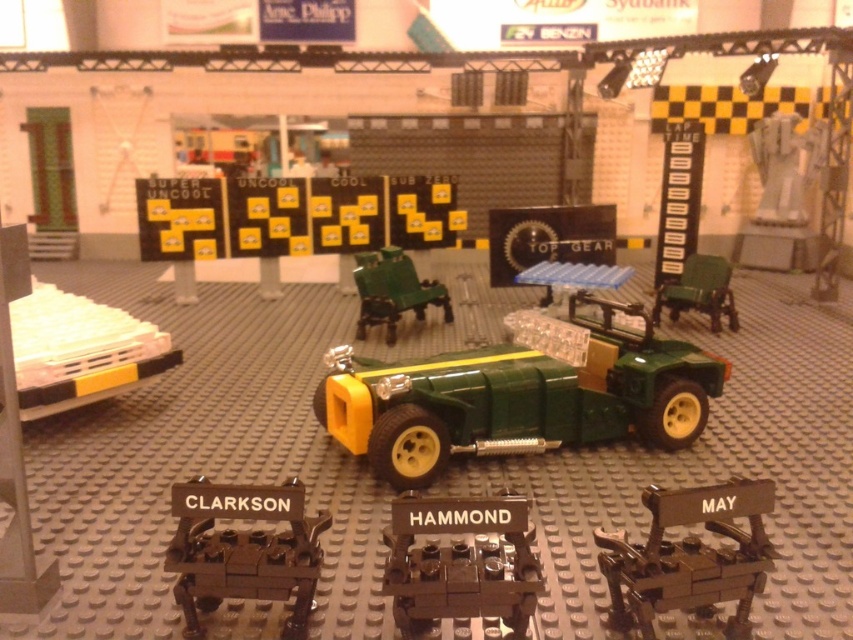
Question: Is green matte toy car at center smaller than white plastic toy at lower left?

Choices:
 (A) yes
 (B) no

Answer: (B)

Question: Among these objects, which one is farthest from the camera?

Choices:
 (A) dark brown metallic engine at lower center
 (B) dark brown wooden chair at center
 (C) metallic black engine at lower center

Answer: (C)

Question: Which object appears closest to the camera in this image?

Choices:
 (A) dark brown metallic engine at lower center
 (B) green matte toy car at center

Answer: (A)

Question: Which of the following is the closest to the observer?

Choices:
 (A) (766, 488)
 (B) (689, 288)
 (C) (300, 580)

Answer: (A)

Question: Does dark brown metallic engine at lower center have a greater width compared to green plastic chairs at center?

Choices:
 (A) yes
 (B) no

Answer: (B)

Question: From the image, what is the correct spatial relationship of green matte toy car at center in relation to dark brown metallic engine at lower center?

Choices:
 (A) left
 (B) right

Answer: (B)